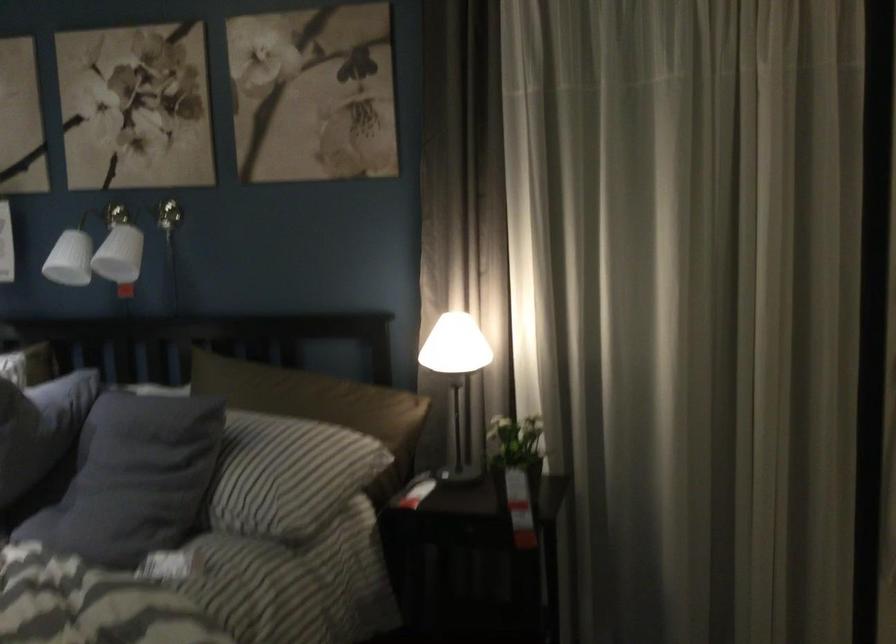
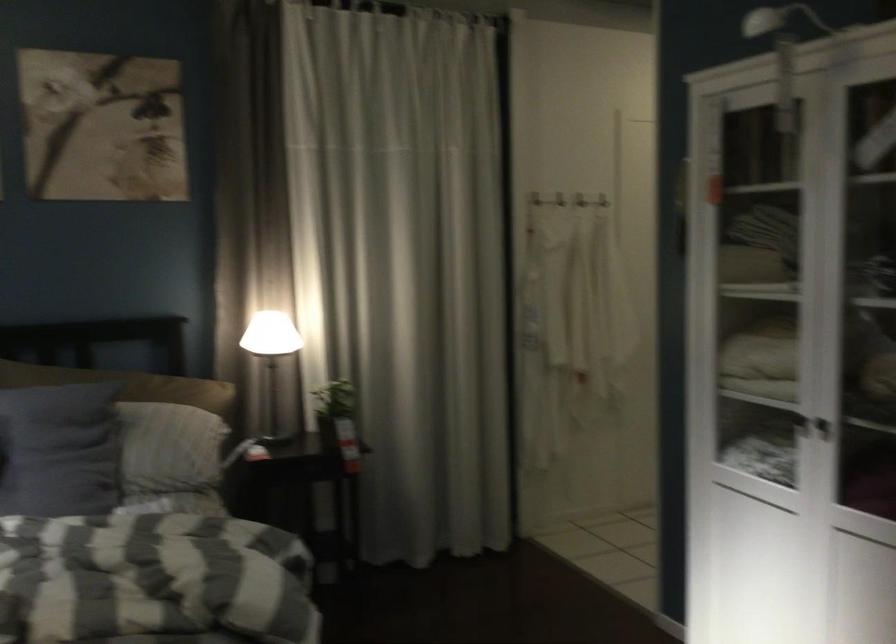
Locate, in the second image, the point that corresponds to [279,474] in the first image.

(173, 442)